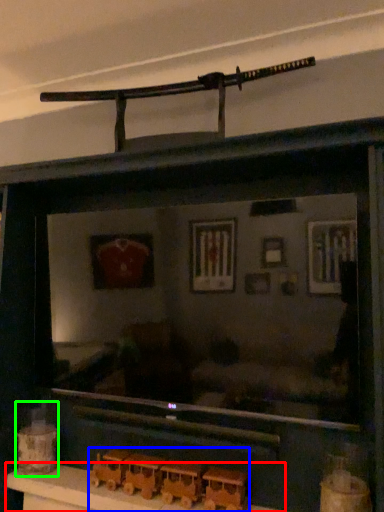
Question: Which object is the farthest from table (highlighted by a red box)? Choose among these: toy (highlighted by a blue box) or toy (highlighted by a green box).

Choices:
 (A) toy
 (B) toy

Answer: (B)